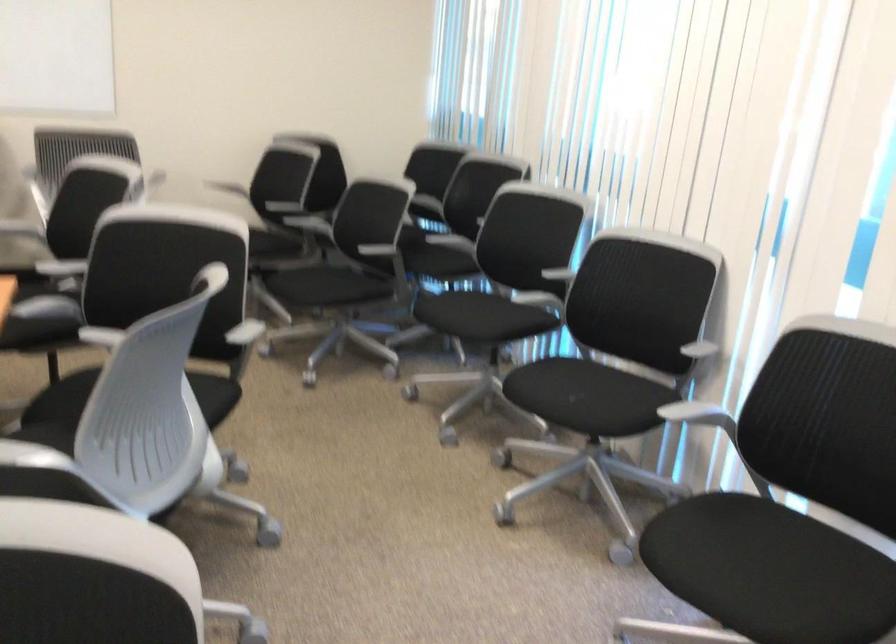
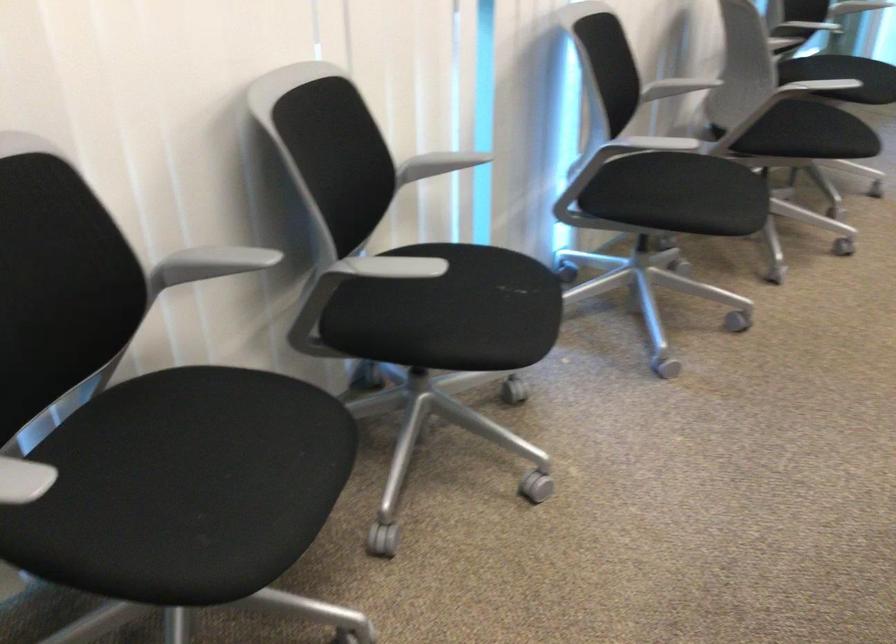
In the second image, find the point that corresponds to point (524, 303) in the first image.

(384, 267)